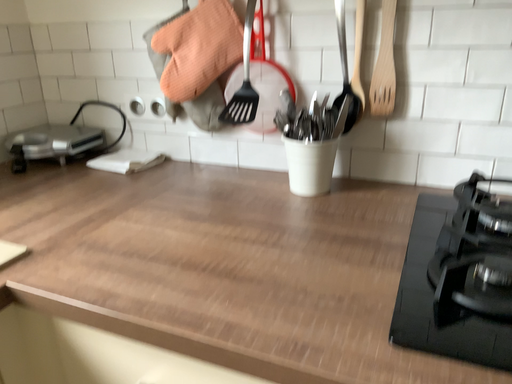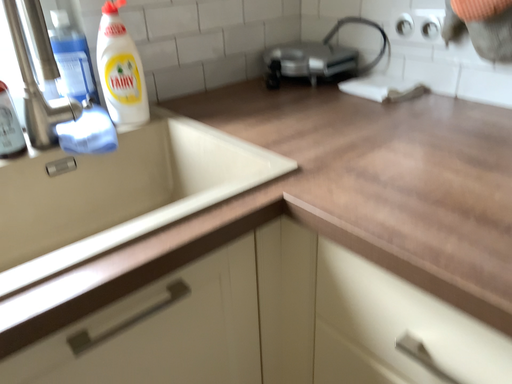
Question: Which way did the camera rotate in the video?

Choices:
 (A) rotated downward
 (B) rotated upward

Answer: (A)